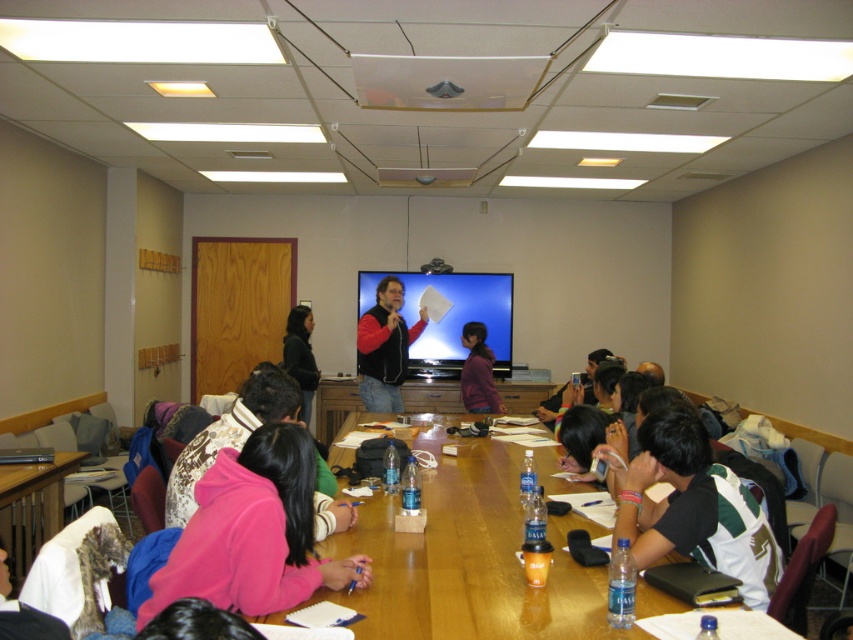
You are sitting at the back of the classroom and want to hand a note to the person wearing the green jersey at center and the dark gray sweater at center. Which one is closer to you?

The dark gray sweater at center is closer to you because the green jersey at center is to the right of it, meaning the dark gray sweater at center is positioned between you and the green jersey at center.

You are standing at the origin point of the room coordinate system. The room has a coordinate system where the bottom left corner is the origin. The door is located at the top right corner. Where is the wooden table at center located in this coordinate system?

The wooden table at center is located at point (469, 563) in the coordinate system.

You are organizing a classroom activity and need to place a new desk between the pink fleece jacket at lower left and the black plastic projector at upper center. Considering their widths, which object will require more space horizontally for the desk placement?

The pink fleece jacket at lower left requires more horizontal space because its width surpasses that of the black plastic projector at upper center.